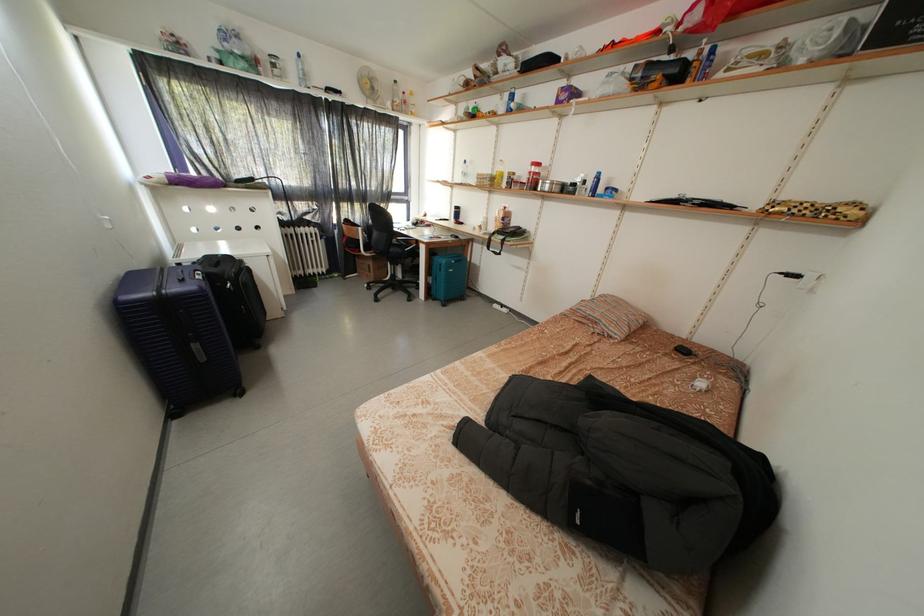
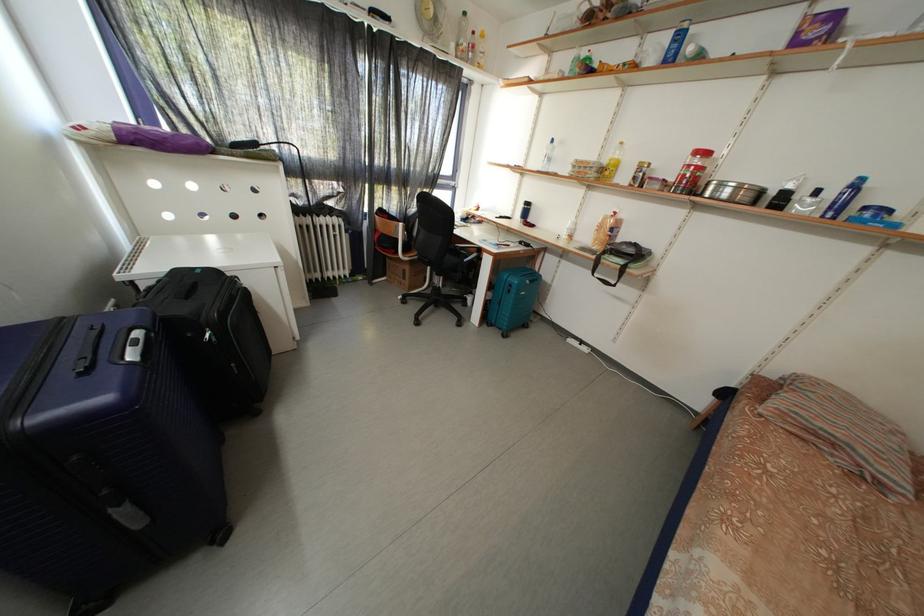
In a continuous first-person perspective shot, in which direction is the camera moving?

The cameraman walked toward left, forward.